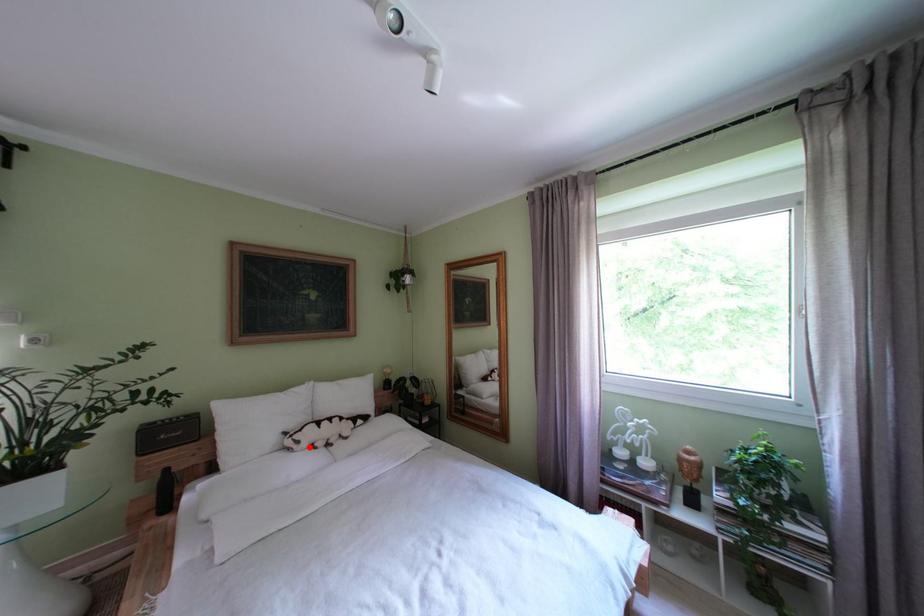
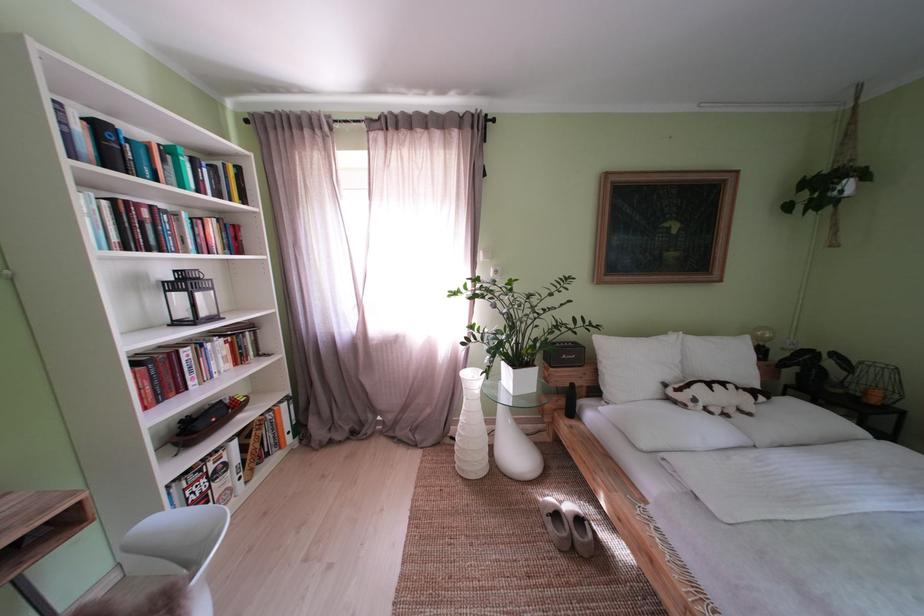
Find the pixel in the second image that matches the highlighted location in the first image.

(706, 406)